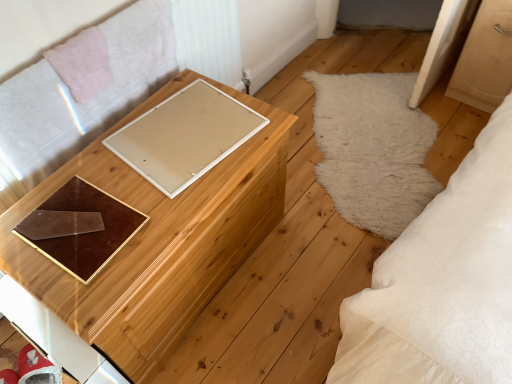
Where is `free area in between brown glossy tray at center and beige matte board at center`? free area in between brown glossy tray at center and beige matte board at center is located at coordinates (125, 180).